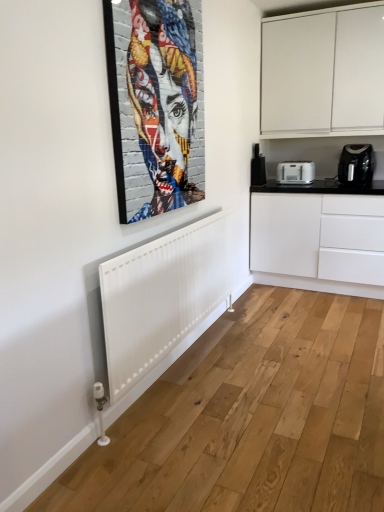
What are the coordinates of `vacant space to the right of black plastic coffee machine at right` in the screenshot? It's located at (278, 185).